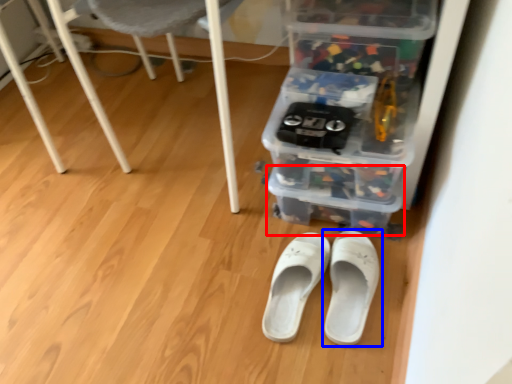
Question: Which of the following is the closest to the observer, storage box (highlighted by a red box) or footwear (highlighted by a blue box)?

Choices:
 (A) storage box
 (B) footwear

Answer: (B)